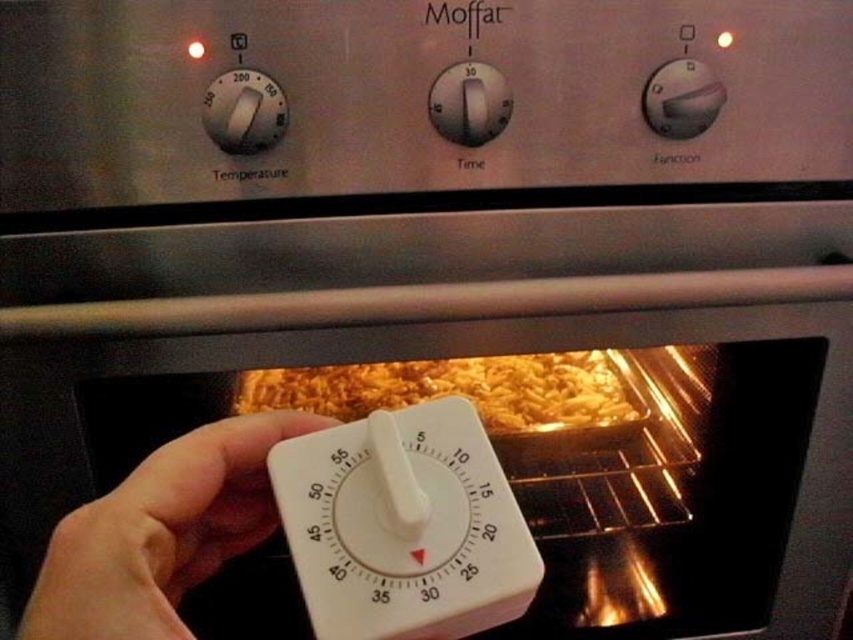
Question: Which is farther from the white plastic timer at lower center?

Choices:
 (A) golden brown pasta at center
 (B) white plastic timer at center
 (C) white plastic thermostat at upper left

Answer: (A)

Question: From the image, what is the correct spatial relationship of white plastic timer at center in relation to white plastic timer at lower center?

Choices:
 (A) left
 (B) right

Answer: (B)

Question: Which object appears closest to the camera in this image?

Choices:
 (A) white plastic timer at center
 (B) white plastic thermostat at upper left
 (C) golden brown pasta at center

Answer: (A)

Question: Among these objects, which one is nearest to the camera?

Choices:
 (A) white plastic thermostat at upper left
 (B) white plastic timer at lower center
 (C) golden brown pasta at center
 (D) white plastic timer at center

Answer: (B)

Question: Does white plastic timer at lower center come behind white plastic thermostat at upper left?

Choices:
 (A) yes
 (B) no

Answer: (B)

Question: From the image, what is the correct spatial relationship of white plastic timer at center in relation to white plastic timer at lower center?

Choices:
 (A) below
 (B) above

Answer: (B)